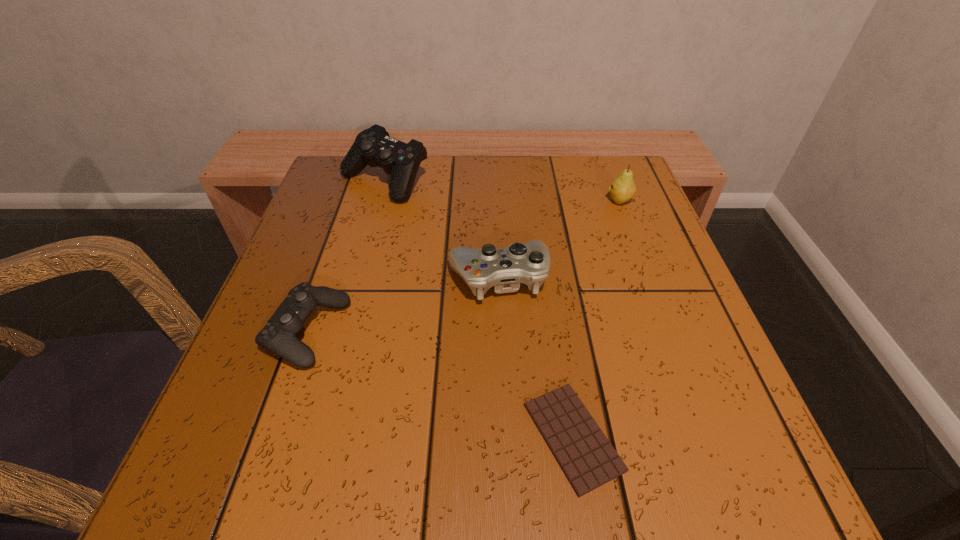
This screenshot has height=540, width=960. I want to click on the tallest control, so click(x=373, y=146).

In order to click on pear in this screenshot , I will do `click(623, 188)`.

Locate an element on the screen. Image resolution: width=960 pixels, height=540 pixels. the rightmost control is located at coordinates (504, 269).

At what (x,y) coordinates should I click in order to perform the action: click on the third shortest object. Please return your answer as a coordinate pair (x, y). This screenshot has height=540, width=960. Looking at the image, I should click on (504, 269).

In order to click on the fourth tallest object in this screenshot , I will do `click(279, 334)`.

In order to click on the shortest object in this screenshot , I will do `click(588, 460)`.

This screenshot has width=960, height=540. Find the location of `chocolate bar`. chocolate bar is located at coordinates (x=588, y=460).

Find the location of a particular element. free space located on the right of the tallest control is located at coordinates 584,181.

The image size is (960, 540). Identify the location of vacant point located on the front of the pear. (670, 334).

Locate an element on the screen. free spot located 0.160m on the left of the third tallest object is located at coordinates (362, 277).